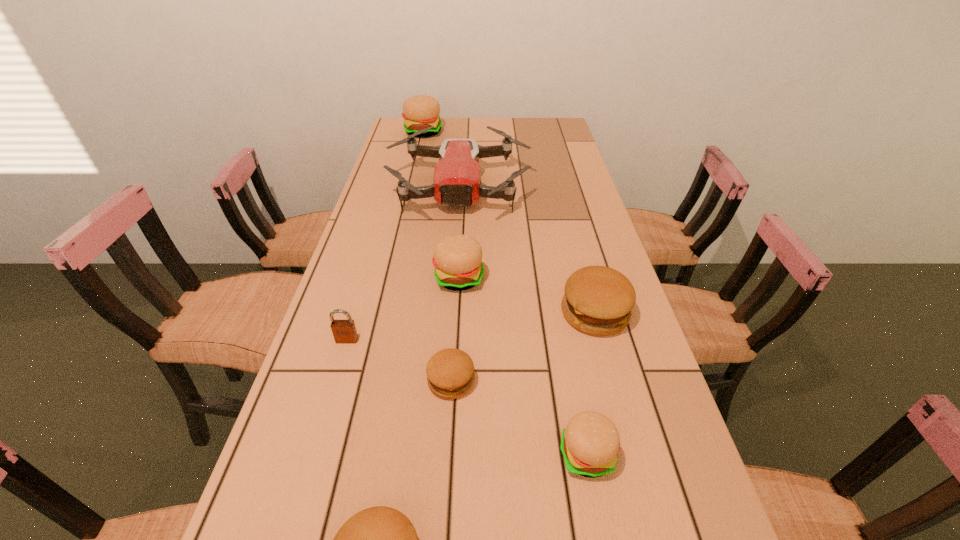
The width and height of the screenshot is (960, 540). In order to click on the biggest beige hamburger in this screenshot , I will do `click(420, 111)`.

This screenshot has height=540, width=960. Identify the location of the farthest hamburger. tap(420, 111).

At what (x,y) coordinates should I click in order to perform the action: click on red drone. Please return your answer as a coordinate pair (x, y). Looking at the image, I should click on (456, 182).

Locate an element on the screen. The image size is (960, 540). drone is located at coordinates (456, 182).

The height and width of the screenshot is (540, 960). What are the coordinates of `the second beige hamburger from right to left` in the screenshot? It's located at (457, 258).

This screenshot has height=540, width=960. I want to click on the second biggest beige hamburger, so click(x=457, y=258).

Where is `the farthest brown hamburger`? This screenshot has width=960, height=540. the farthest brown hamburger is located at coordinates (598, 300).

At what (x,y) coordinates should I click in order to perform the action: click on the rightmost brown hamburger. Please return your answer as a coordinate pair (x, y). Looking at the image, I should click on (598, 300).

Where is `brown padlock`? brown padlock is located at coordinates (344, 331).

In order to click on the rightmost beige hamburger in this screenshot , I will do `click(590, 442)`.